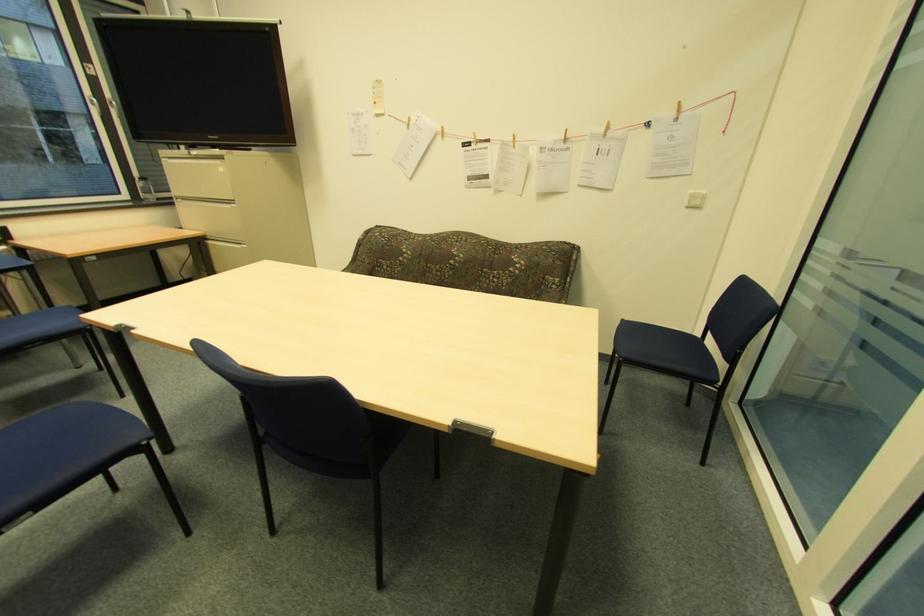
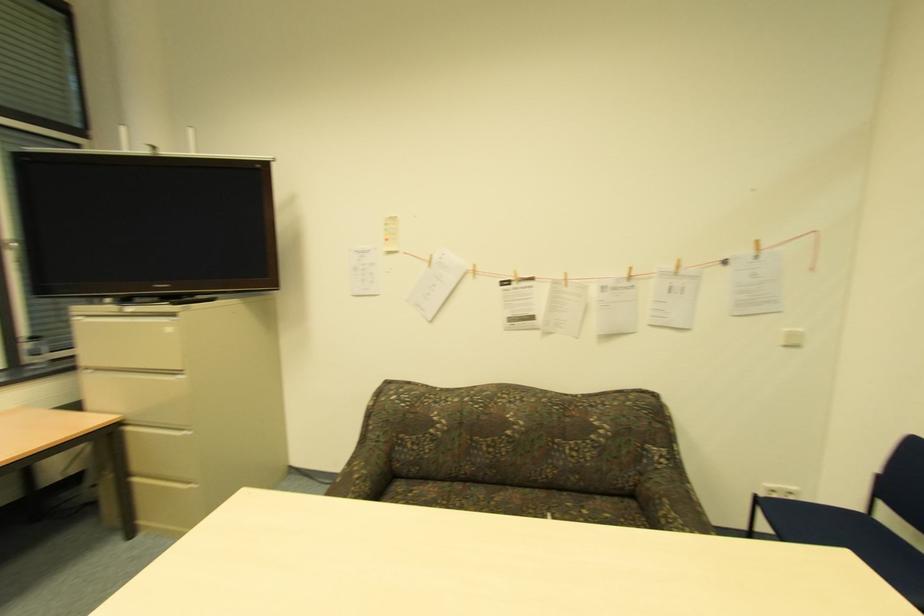
Find the pixel in the second image that matches [244,244] in the first image.

(187, 429)